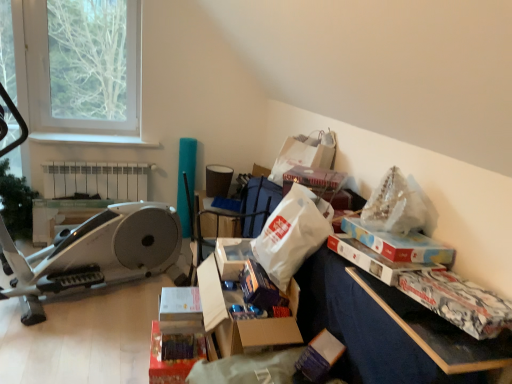
Question: Would you say white plastic radiator at upper left is part of translucent plastic bag at upper right, which is the first paper bag from front to back,'s contents?

Choices:
 (A) yes
 (B) no

Answer: (B)

Question: Can you confirm if translucent plastic bag at upper right, the third paper bag when ordered from back to front, is wider than white plastic radiator at upper left?

Choices:
 (A) yes
 (B) no

Answer: (A)

Question: From a real-world perspective, does translucent plastic bag at upper right, which is the first paper bag from front to back, stand above white plastic radiator at upper left?

Choices:
 (A) yes
 (B) no

Answer: (A)

Question: Could you tell me if translucent plastic bag at upper right, which is the first paper bag from front to back, is turned towards white plastic radiator at upper left?

Choices:
 (A) yes
 (B) no

Answer: (B)

Question: Is translucent plastic bag at upper right, the third paper bag when ordered from back to front, not inside white plastic radiator at upper left?

Choices:
 (A) yes
 (B) no

Answer: (A)

Question: Is point (267, 258) closer or farther from the camera than point (369, 215)?

Choices:
 (A) farther
 (B) closer

Answer: (A)

Question: From a real-world perspective, relative to translucent plastic bag at upper right, which is the first paper bag from front to back, is white matte paper bag at center, marked as the 2th paper bag in a front-to-back arrangement, vertically above or below?

Choices:
 (A) above
 (B) below

Answer: (B)

Question: Is white matte paper bag at center, the second paper bag positioned from the back, in front of or behind translucent plastic bag at upper right, the third paper bag when ordered from back to front, in the image?

Choices:
 (A) front
 (B) behind

Answer: (B)

Question: Visually, is white matte paper bag at center, marked as the 2th paper bag in a front-to-back arrangement, positioned to the left or to the right of translucent plastic bag at upper right, which is the first paper bag from front to back?

Choices:
 (A) right
 (B) left

Answer: (B)

Question: Would you say matte cardboard storage box at center, which is the 2th storage box from top to bottom, is inside or outside translucent plastic bag at upper right, which is the first paper bag from front to back?

Choices:
 (A) inside
 (B) outside

Answer: (B)

Question: Relative to translucent plastic bag at upper right, the third paper bag when ordered from back to front, is matte cardboard storage box at center, which is counted as the 2th storage box, starting from the right, in front or behind?

Choices:
 (A) behind
 (B) front

Answer: (A)

Question: Visually, is matte cardboard storage box at center, which is the 2th storage box from top to bottom, positioned to the left or to the right of translucent plastic bag at upper right, the third paper bag when ordered from back to front?

Choices:
 (A) right
 (B) left

Answer: (B)

Question: From a real-world perspective, is matte cardboard storage box at center, which is counted as the 2th storage box, starting from the right, positioned above or below translucent plastic bag at upper right, which is the first paper bag from front to back?

Choices:
 (A) below
 (B) above

Answer: (A)

Question: Considering the positions of point (321, 140) and point (419, 210), is point (321, 140) closer or farther from the camera than point (419, 210)?

Choices:
 (A) farther
 (B) closer

Answer: (A)

Question: Looking at the image, does white paper bag at upper center, which is the 3th paper bag from front to back, seem bigger or smaller compared to translucent plastic bag at upper right, which is the first paper bag from front to back?

Choices:
 (A) big
 (B) small

Answer: (A)